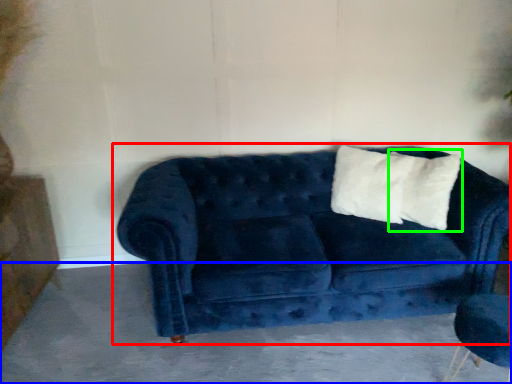
Question: Estimate the real-world distances between objects in this image. Which object is closer to studio couch (highlighted by a red box), concrete (highlighted by a blue box) or pillow (highlighted by a green box)?

Choices:
 (A) concrete
 (B) pillow

Answer: (A)